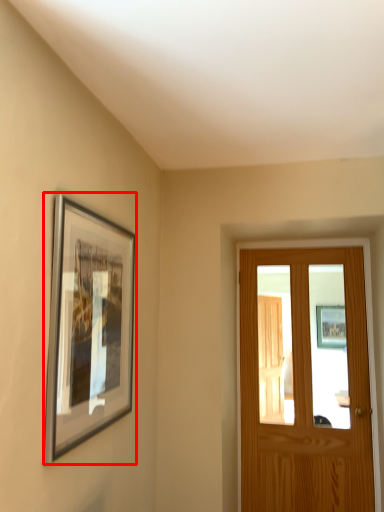
Question: From the image's perspective, what is the correct spatial relationship of picture frame (annotated by the red box) in relation to door?

Choices:
 (A) above
 (B) below

Answer: (A)